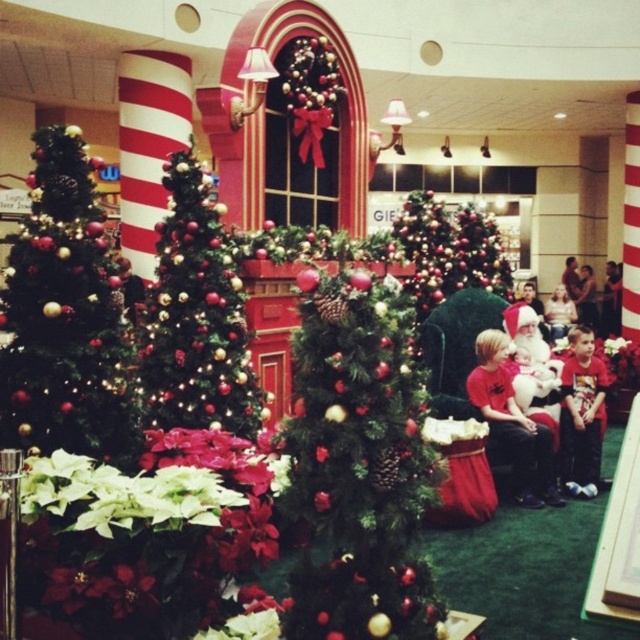
Where is the shiny gold christmas tree at center located in the image?

The shiny gold christmas tree at center is located at point (196, 317) in the image.